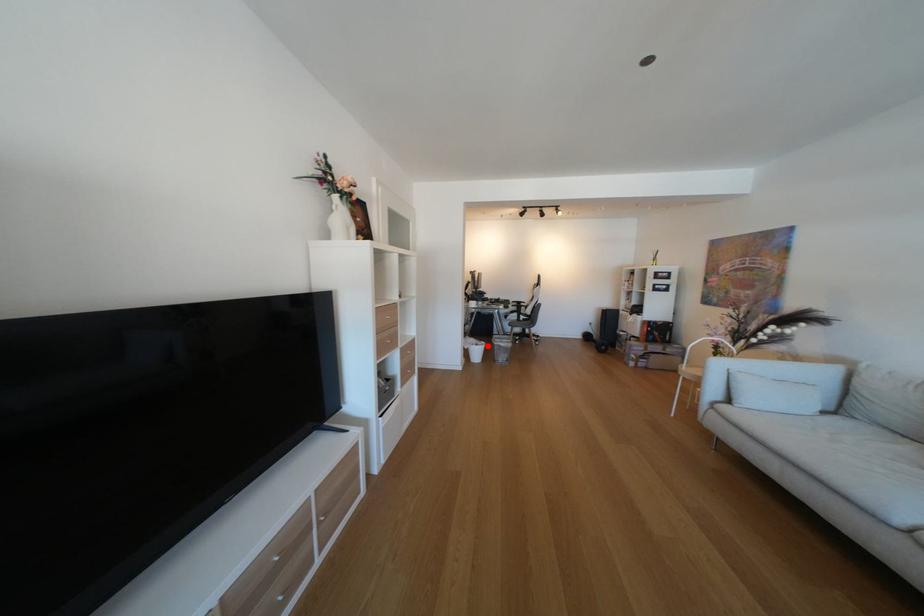
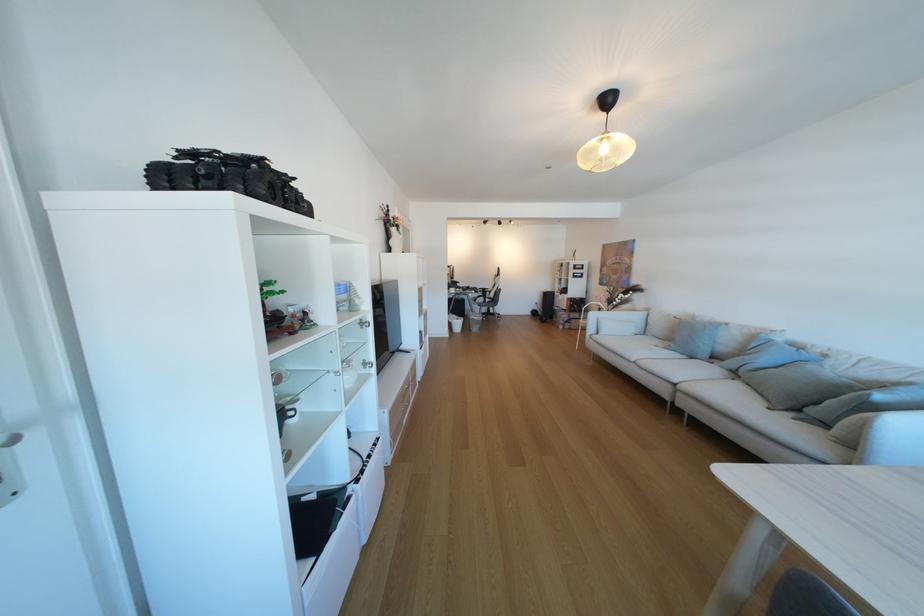
The point at the highlighted location is marked in the first image. Where is the corresponding point in the second image?

(468, 321)